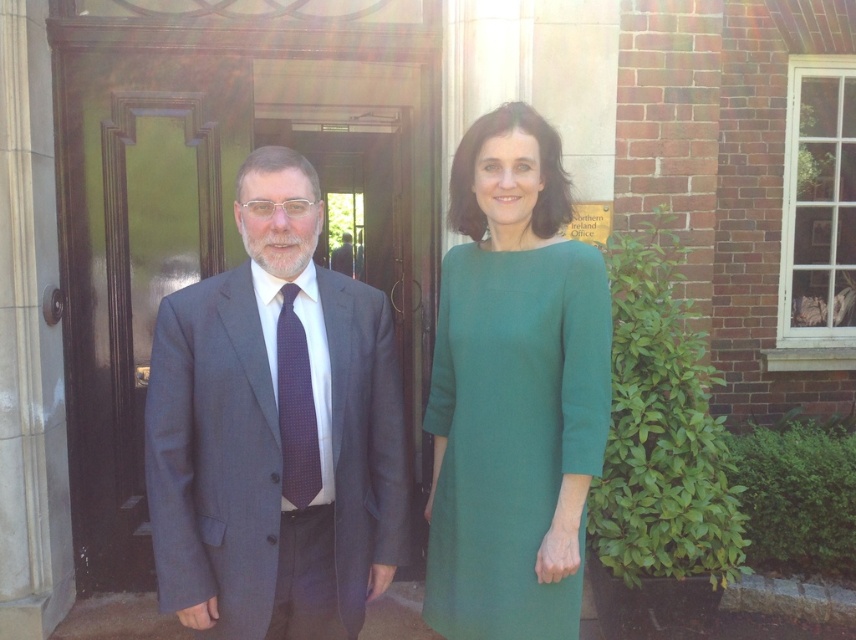
You are a photographer trying to capture a closeup shot of the green woolen dress at center and the purple dotted tie at center. Given that your camera can only focus on objects within a 15 inch range, will you be able to capture both in focus?

The green woolen dress at center and purple dotted tie at center are 17.43 inches apart from each other, which exceeds the camera focus range of 15 inches. Therefore, you cannot capture both in focus simultaneously.

You are a photographer trying to capture a clear photo of both the green woolen dress at center and the purple dotted tie at center. Since you want to focus on their heights, which one should you adjust your camera angle to look up at?

The green woolen dress at center is much taller than the purple dotted tie at center, so you should adjust your camera angle to look up at the green woolen dress at center.

Consider the image. You are a photographer trying to capture a group photo of the matte gray suit at center and the green woolen dress at center. Since you want to ensure both subjects are fully visible, which subject requires more space in the frame horizontally?

The matte gray suit at center requires more space in the frame horizontally because its width is larger than the green woolen dress at center.